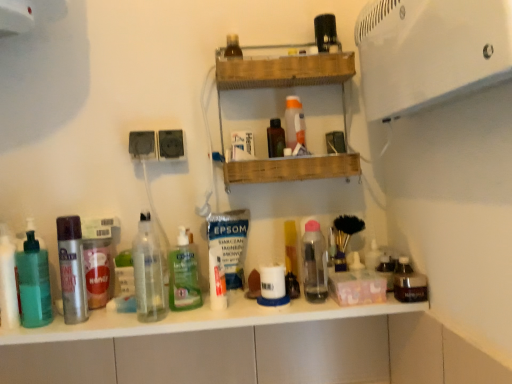
I want to click on empty space that is in between translucent plastic soap dispenser at left, marked as the first bottle in a left-to-right arrangement, and clear glass bottle at center, the third bottle viewed from the right, so click(97, 324).